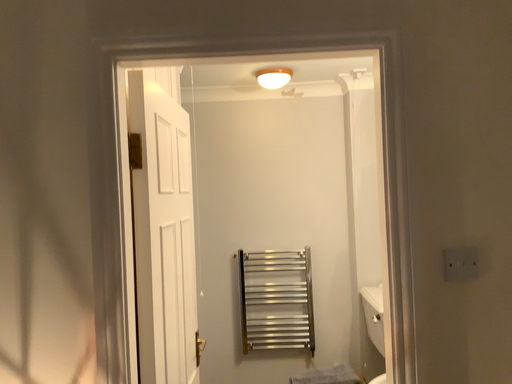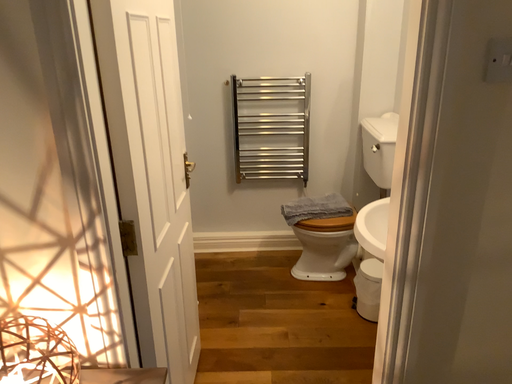
Question: Which way did the camera rotate in the video?

Choices:
 (A) rotated downward
 (B) rotated upward

Answer: (A)